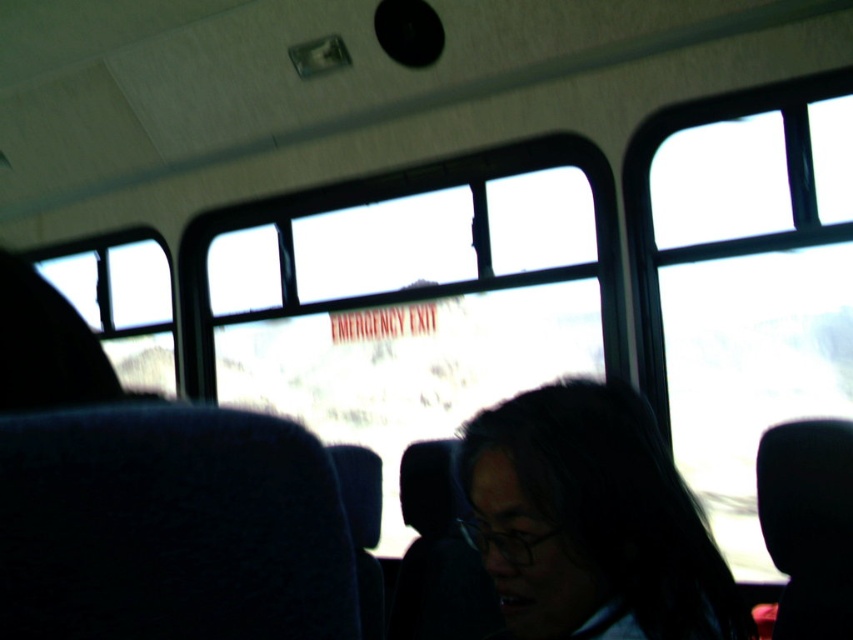
From the picture: You are a passenger on a bus and need to locate the emergency exit sign. You see a transparent glass emergency exit sign at center and a black matte hair at center. Which object is taller?

The transparent glass emergency exit sign at center is much taller than the black matte hair at center.

You are a passenger on a bus and you want to let some fresh air in. There are two windows available, the transparent glass window at upper right and the transparent glass window at left. Which window should you choose to open if you want to maximize the airflow into the bus?

The transparent glass window at left should be chosen because it is larger than the transparent glass window at upper right, allowing more airflow.